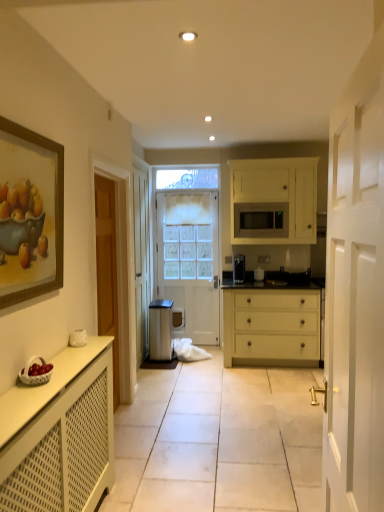
The width and height of the screenshot is (384, 512). What are the coordinates of `free location in front of metallic trash bin at center` in the screenshot? It's located at (167, 369).